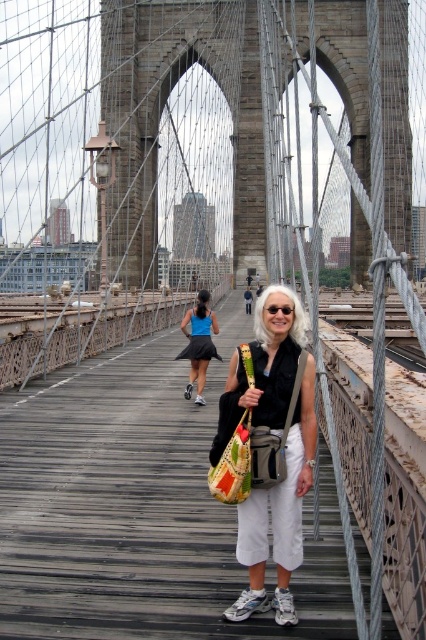
You are a photographer standing on the Brooklyn Bridge and want to capture both the white cotton pants at center and the blue fabric skirt at center in the same frame. Given that your camera has a 50mm lens, which has a field of view of approximately 46 degrees, can you fit both items into your shot without moving closer or farther away?

The distance between the white cotton pants at center and the blue fabric skirt at center is 19.59 meters. With a 50mm lens providing a 46 degree field of view, the maximum horizontal coverage at this distance would be approximately 16.5 meters. Since 19.59 meters exceeds this, you cannot fit both items into the frame without adjusting your position.

You are a photographer trying to capture the woman in the scene. You notice the white cotton pants at center and the black plastic goggles at center. Which item should you focus on if you want to ensure the subject fills the frame more?

The white cotton pants at center might be wider than black plastic goggles at center, so focusing on the white cotton pants at center would likely fill the frame more effectively.